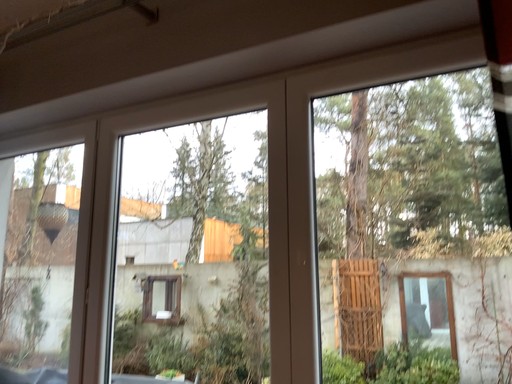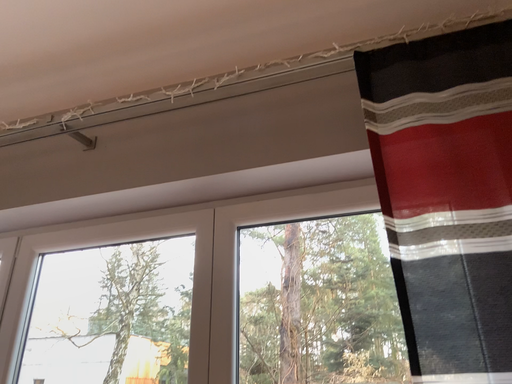
Question: How did the camera likely rotate when shooting the video?

Choices:
 (A) rotated downward
 (B) rotated upward

Answer: (B)